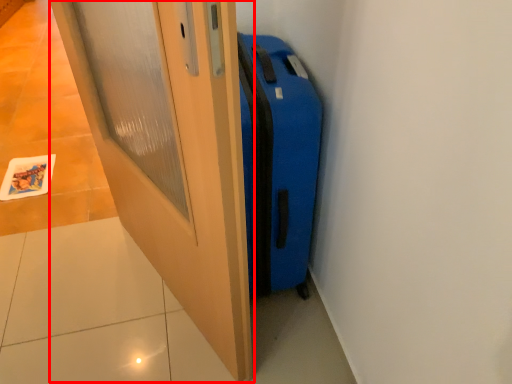
Question: From the image's perspective, considering the relative positions of door (annotated by the red box) and suitcase in the image provided, where is door (annotated by the red box) located with respect to the staircase?

Choices:
 (A) above
 (B) below

Answer: (B)